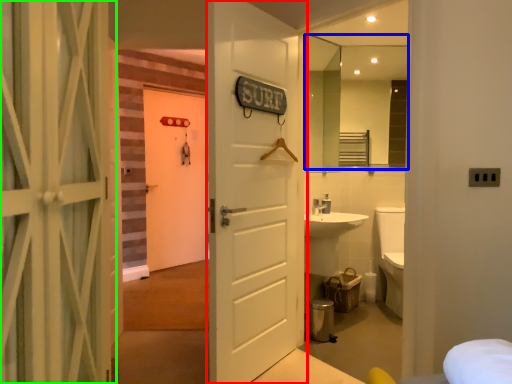
Question: Based on their relative distances, which object is farther from door (highlighted by a red box)? Choose from mirror (highlighted by a blue box) and door (highlighted by a green box).

Choices:
 (A) mirror
 (B) door

Answer: (A)